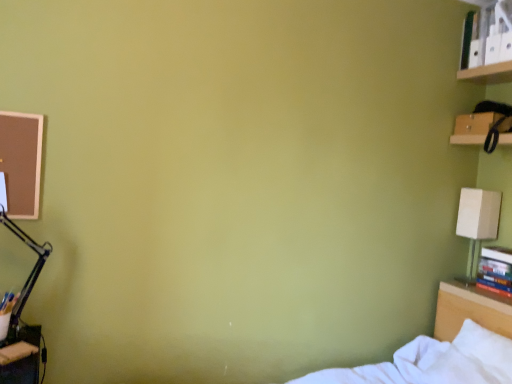
Find the location of `wooden shelf at upper right`. wooden shelf at upper right is located at coordinates (467, 139).

Where is `white soft bed at lower right`? white soft bed at lower right is located at coordinates (444, 347).

Is beige fabric lampshade at upper right beside wooden shelf at upper right?

There is a gap between beige fabric lampshade at upper right and wooden shelf at upper right.

Can you confirm if beige fabric lampshade at upper right is shorter than wooden shelf at upper right?

No, beige fabric lampshade at upper right is not shorter than wooden shelf at upper right.

Is beige fabric lampshade at upper right not inside wooden shelf at upper right?

Yes.

Considering the relative sizes of beige fabric lampshade at upper right and wooden shelf at upper right in the image provided, is beige fabric lampshade at upper right thinner than wooden shelf at upper right?

Indeed, beige fabric lampshade at upper right has a lesser width compared to wooden shelf at upper right.

What's the angular difference between wooden shelf at upper right and hardcover books at right, which appears as the second book when viewed from the top,'s facing directions?

The facing directions of wooden shelf at upper right and hardcover books at right, which appears as the second book when viewed from the top, are 0.431 degrees apart.

Which is in front, wooden shelf at upper right or hardcover books at right, which appears as the second book when viewed from the top?

wooden shelf at upper right is closer to the camera.

Is hardcover books at right, arranged as the first book when ordered from the bottom, at the back of wooden shelf at upper right?

No.

You are a GUI agent. You are given a task and a screenshot of the screen. Output one action in this format:
    pyautogui.click(x=<x>, y=<y>)
    Task: Click on the book behind the wooden shelf at upper right
    Image resolution: width=512 pixels, height=384 pixels.
    Given the screenshot: What is the action you would take?
    pyautogui.click(x=496, y=269)

Is beige fabric lampshade at upper right oriented away from hardcover books at right, arranged as the first book when ordered from the bottom?

No, beige fabric lampshade at upper right is not facing the opposite direction of hardcover books at right, arranged as the first book when ordered from the bottom.

From the image's perspective, which one is positioned higher, beige fabric lampshade at upper right or hardcover books at right, arranged as the first book when ordered from the bottom?

beige fabric lampshade at upper right is shown above in the image.

Which object is further away from the camera taking this photo, beige fabric lampshade at upper right or hardcover books at right, which appears as the second book when viewed from the top?

beige fabric lampshade at upper right.

Can you confirm if beige fabric lampshade at upper right is wider than hardcover books at right, which appears as the second book when viewed from the top?

Correct, the width of beige fabric lampshade at upper right exceeds that of hardcover books at right, which appears as the second book when viewed from the top.

Is beige fabric lampshade at upper right wider than white soft bed at lower right?

No.

Is beige fabric lampshade at upper right oriented towards white soft bed at lower right?

No, beige fabric lampshade at upper right is not oriented towards white soft bed at lower right.

Is beige fabric lampshade at upper right taller than white soft bed at lower right?

Incorrect, the height of beige fabric lampshade at upper right is not larger of that of white soft bed at lower right.

Between point (465, 283) and point (489, 350), which one is positioned behind?

The point (465, 283) is behind.

From the image's perspective, is wooden shelf at upper right located above or below wooden desk at lower left?

wooden shelf at upper right is situated higher than wooden desk at lower left in the image.

Based on the photo, how much distance is there between wooden shelf at upper right and wooden desk at lower left?

wooden shelf at upper right and wooden desk at lower left are 2.34 meters apart from each other.

From a real-world perspective, is wooden shelf at upper right positioned under wooden desk at lower left based on gravity?

No.

Looking at this image, is wooden shelf at upper right further to the viewer compared to wooden desk at lower left?

Yes.

Locate an element on the screen. The width and height of the screenshot is (512, 384). table that appears below the hardcover books at right, which appears as the second book when viewed from the top (from a real-world perspective) is located at coordinates (25, 356).

From the image's perspective, is hardcover books at right, arranged as the first book when ordered from the bottom, located beneath wooden desk at lower left?

Incorrect, from the image's perspective, hardcover books at right, arranged as the first book when ordered from the bottom, is higher than wooden desk at lower left.

Is hardcover books at right, which appears as the second book when viewed from the top, smaller than wooden desk at lower left?

No, hardcover books at right, which appears as the second book when viewed from the top, is not smaller than wooden desk at lower left.

Which object is more forward, hardcover books at right, which appears as the second book when viewed from the top, or wooden desk at lower left?

wooden desk at lower left is more forward.

Who is taller, wooden desk at lower left or hardcover books at right, arranged as the first book when ordered from the bottom?

hardcover books at right, arranged as the first book when ordered from the bottom, is taller.

Is wooden desk at lower left turned away from hardcover books at right, arranged as the first book when ordered from the bottom?

No, wooden desk at lower left is not facing the opposite direction of hardcover books at right, arranged as the first book when ordered from the bottom.

From the image's perspective, is wooden desk at lower left below hardcover books at right, arranged as the first book when ordered from the bottom?

Yes, from the image's perspective, wooden desk at lower left is beneath hardcover books at right, arranged as the first book when ordered from the bottom.

Between wooden desk at lower left and hardcover books at right, which appears as the second book when viewed from the top, which one is positioned behind?

hardcover books at right, which appears as the second book when viewed from the top, is behind.

Where is `shelf above the beige fabric lampshade at upper right (from a real-world perspective)`? shelf above the beige fabric lampshade at upper right (from a real-world perspective) is located at coordinates (467, 139).

Locate an element on the screen. The image size is (512, 384). shelf in front of the hardcover books at right, arranged as the first book when ordered from the bottom is located at coordinates (467, 139).

Estimate the real-world distances between objects in this image. Which object is closer to beige fabric lampshade at upper right, wooden desk at lower left or white cardboard book at upper right, arranged as the 1th book when viewed from the top?

Among the two, white cardboard book at upper right, arranged as the 1th book when viewed from the top, is located nearer to beige fabric lampshade at upper right.

From the image, which object appears to be farther from wooden desk at lower left, white soft bed at lower right or white cardboard book at upper right, arranged as the 1th book when viewed from the top?

white cardboard book at upper right, arranged as the 1th book when viewed from the top.

Based on the photo, when comparing their distances from white soft bed at lower right, does white cardboard book at upper right, marked as the second book in a bottom-to-top arrangement, or beige fabric lampshade at upper right seem further?

Among the two, white cardboard book at upper right, marked as the second book in a bottom-to-top arrangement, is located further to white soft bed at lower right.

Considering their positions, is white soft bed at lower right positioned further to white cardboard book at upper right, arranged as the 1th book when viewed from the top, than wooden desk at lower left?

Among the two, wooden desk at lower left is located further to white cardboard book at upper right, arranged as the 1th book when viewed from the top.

When comparing their distances from white soft bed at lower right, does hardcover books at right, which appears as the second book when viewed from the top, or white cardboard book at upper right, arranged as the 1th book when viewed from the top, seem closer?

Based on the image, hardcover books at right, which appears as the second book when viewed from the top, appears to be nearer to white soft bed at lower right.

Which object lies further to the anchor point beige fabric lampshade at upper right, white cardboard book at upper right, arranged as the 1th book when viewed from the top, or wooden desk at lower left?

wooden desk at lower left is further to beige fabric lampshade at upper right.

Estimate the real-world distances between objects in this image. Which object is further from wooden shelf at upper right, wooden desk at lower left or white cardboard book at upper right, arranged as the 1th book when viewed from the top?

wooden desk at lower left is positioned further to the anchor wooden shelf at upper right.

Considering their positions, is white cardboard book at upper right, marked as the second book in a bottom-to-top arrangement, positioned further to beige fabric lampshade at upper right than wooden shelf at upper right?

Among the two, white cardboard book at upper right, marked as the second book in a bottom-to-top arrangement, is located further to beige fabric lampshade at upper right.

Find the location of a particular element. The width and height of the screenshot is (512, 384). book between white cardboard book at upper right, arranged as the 1th book when viewed from the top, and white soft bed at lower right vertically is located at coordinates (496, 269).

Find the location of `table lamp situated between wooden desk at lower left and hardcover books at right, arranged as the first book when ordered from the bottom, from left to right`. table lamp situated between wooden desk at lower left and hardcover books at right, arranged as the first book when ordered from the bottom, from left to right is located at coordinates (477, 221).

Where is `shelf between white cardboard book at upper right, arranged as the 1th book when viewed from the top, and white soft bed at lower right, in the vertical direction`? shelf between white cardboard book at upper right, arranged as the 1th book when viewed from the top, and white soft bed at lower right, in the vertical direction is located at coordinates (467, 139).

Locate an element on the screen. The image size is (512, 384). shelf between white cardboard book at upper right, arranged as the 1th book when viewed from the top, and hardcover books at right, which appears as the second book when viewed from the top, in the vertical direction is located at coordinates (467, 139).